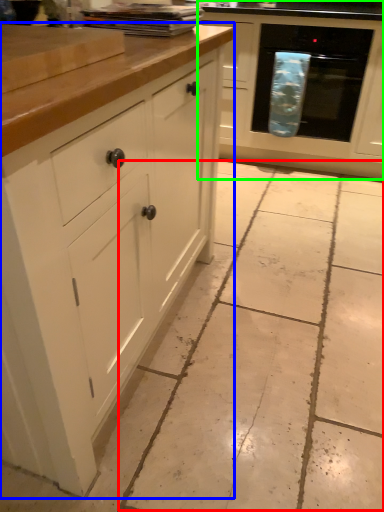
Question: Considering the real-world distances, which object is farthest from concrete (highlighted by a red box)? cabinetry (highlighted by a blue box) or cabinetry (highlighted by a green box)?

Choices:
 (A) cabinetry
 (B) cabinetry

Answer: (B)